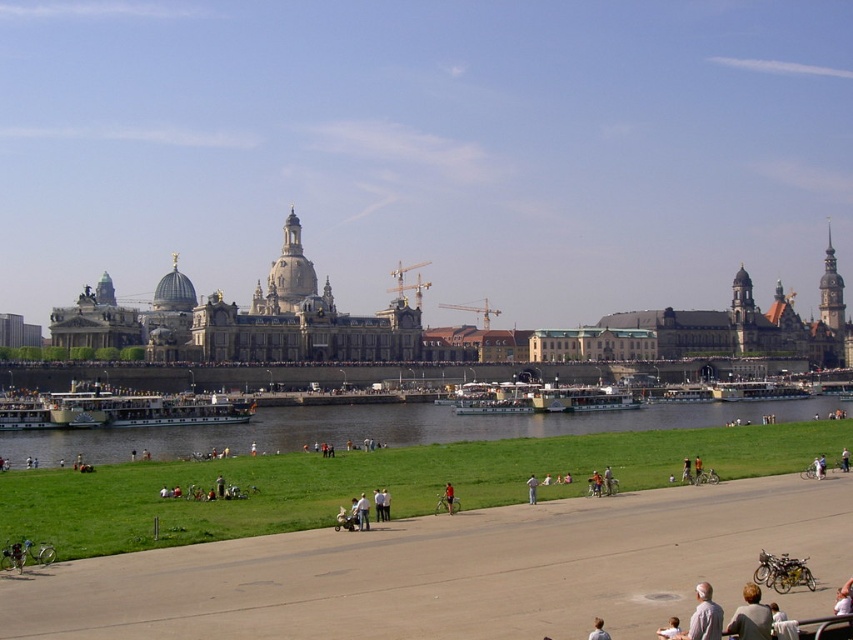
You are a photographer standing in the park and see a person wearing light blue jeans at center and a red shirt at center. Which clothing item is closer to the ground?

The light blue jeans at center is positioned under the red shirt at center, so the light blue jeans at center is closer to the ground.

You are standing at the center of the image and want to find the green grass at lower center. According to the coordinates provided, in which direction should you look to locate it?

The green grass at lower center is located at coordinates point (386, 428), which means you should look downward from the center to find it since the y coordinate 0.454 is below the center point.